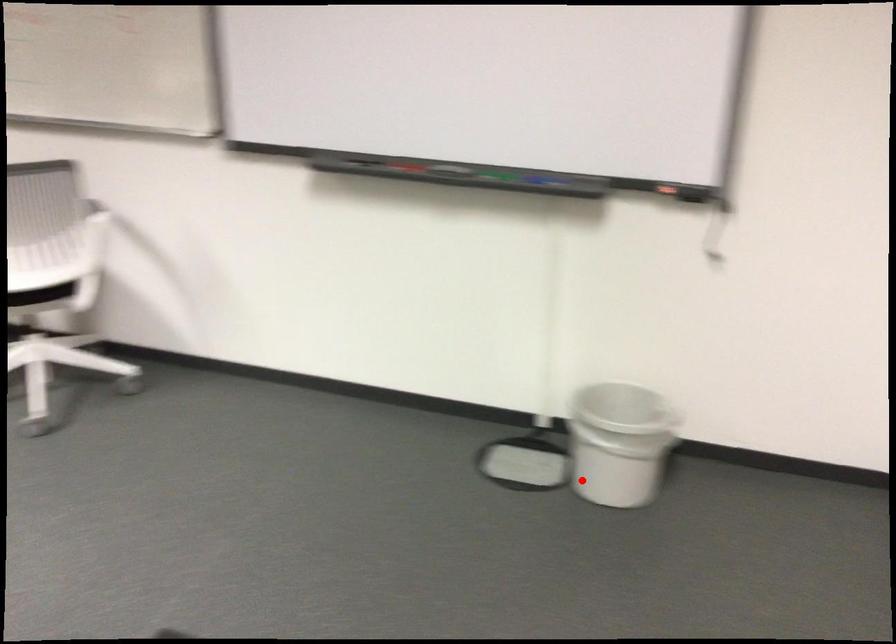
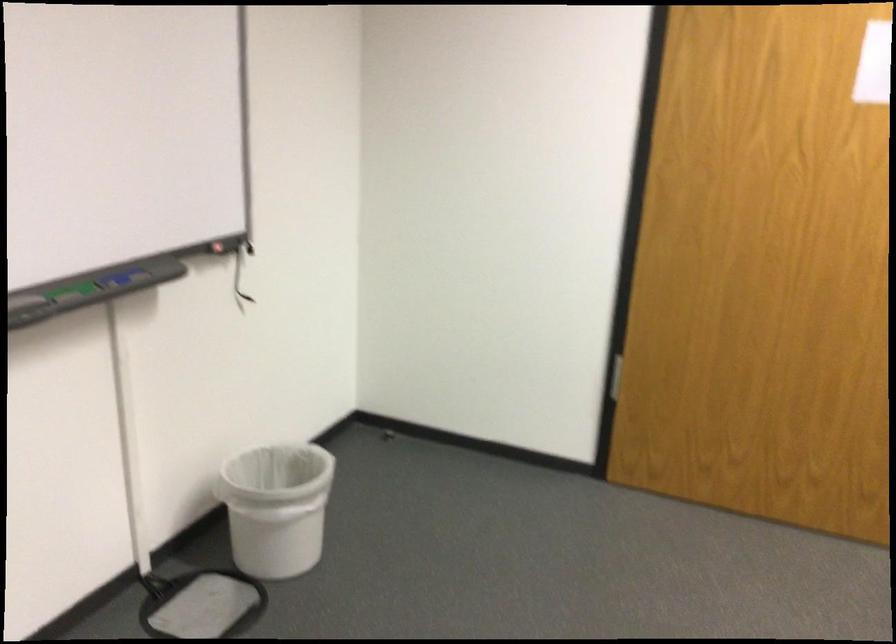
The point at the highlighted location is marked in the first image. Where is the corresponding point in the second image?

(277, 507)